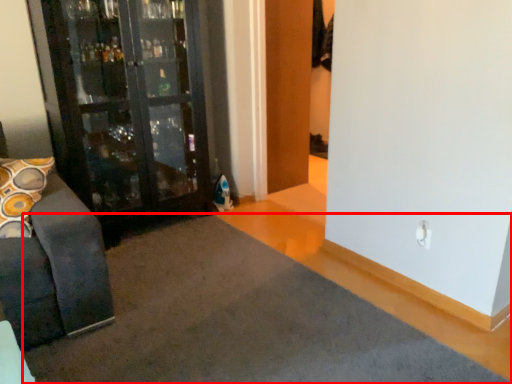
Question: From the image's perspective, considering the relative positions of doormat (annotated by the red box) and door in the image provided, where is doormat (annotated by the red box) located with respect to the staircase?

Choices:
 (A) below
 (B) above

Answer: (A)